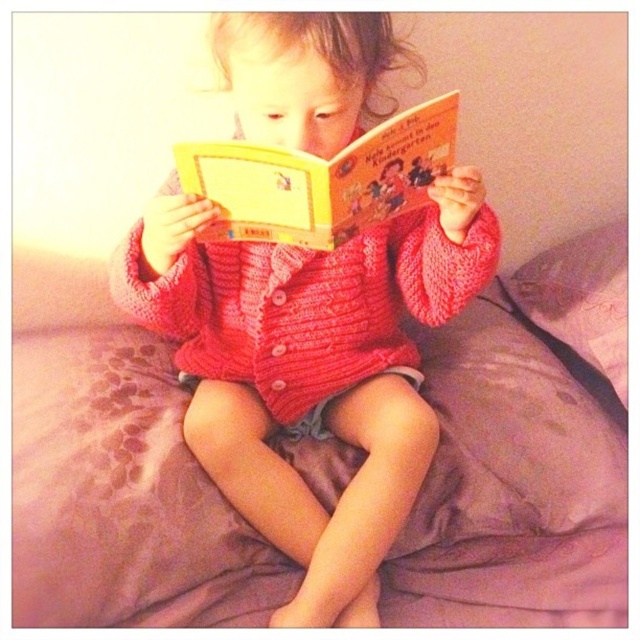
Question: Can you confirm if pink fabric bed at center is positioned above yellow paper at center?

Choices:
 (A) no
 (B) yes

Answer: (A)

Question: Which object is closer to the camera taking this photo?

Choices:
 (A) knitted red sweater at center
 (B) pink fabric bed at center
 (C) purple soft pillow at upper right

Answer: (B)

Question: Which point appears closest to the camera in this image?

Choices:
 (A) (406, 168)
 (B) (611, 456)
 (C) (529, 289)
 (D) (305, 541)

Answer: (A)

Question: Among these points, which one is nearest to the camera?

Choices:
 (A) (x=362, y=202)
 (B) (x=624, y=388)
 (C) (x=204, y=355)

Answer: (A)

Question: Is knitted red sweater at center smaller than yellow paper at center?

Choices:
 (A) yes
 (B) no

Answer: (B)

Question: Is pink fabric bed at center to the right of yellow paper at center from the viewer's perspective?

Choices:
 (A) yes
 (B) no

Answer: (A)